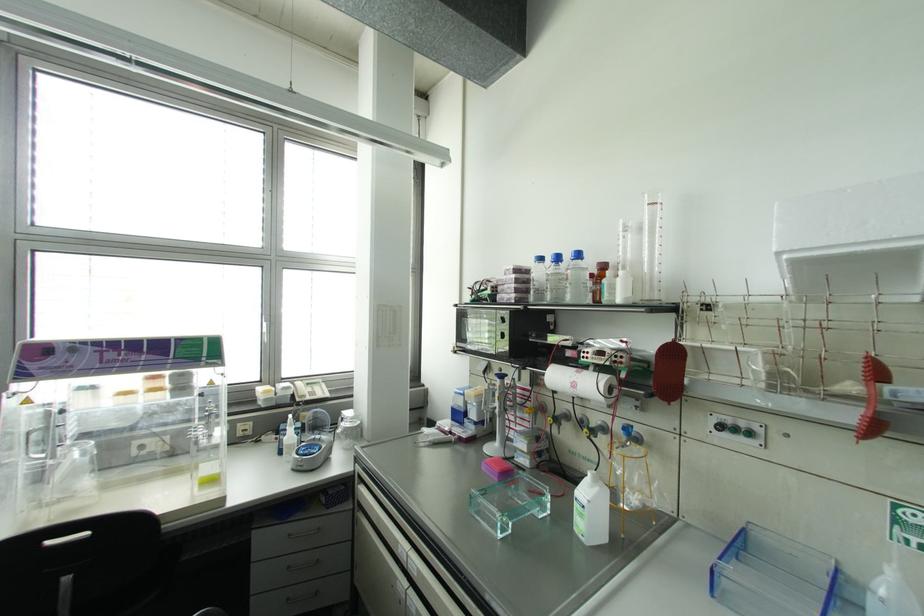
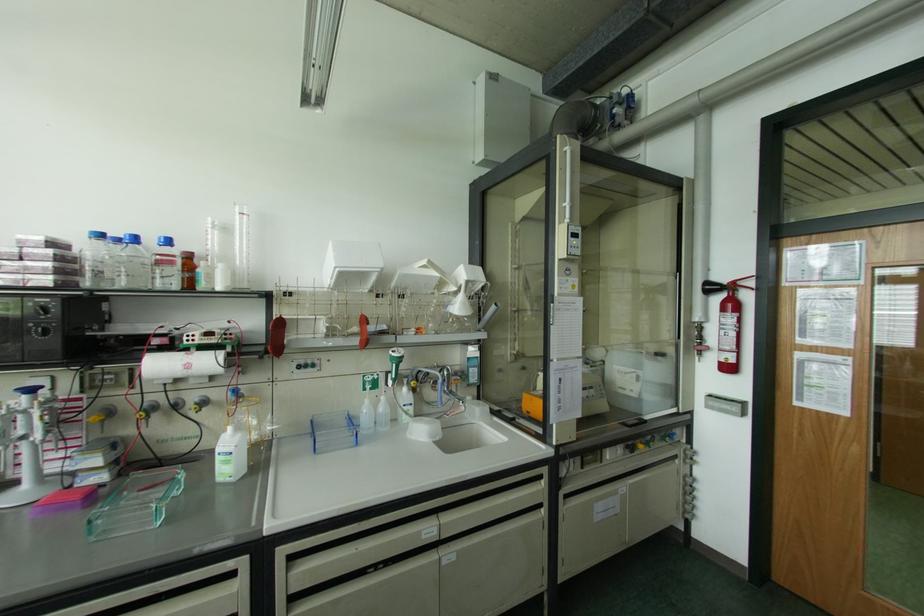
In the second image, find the point that corresponds to the point at 578,254 in the first image.

(167, 241)